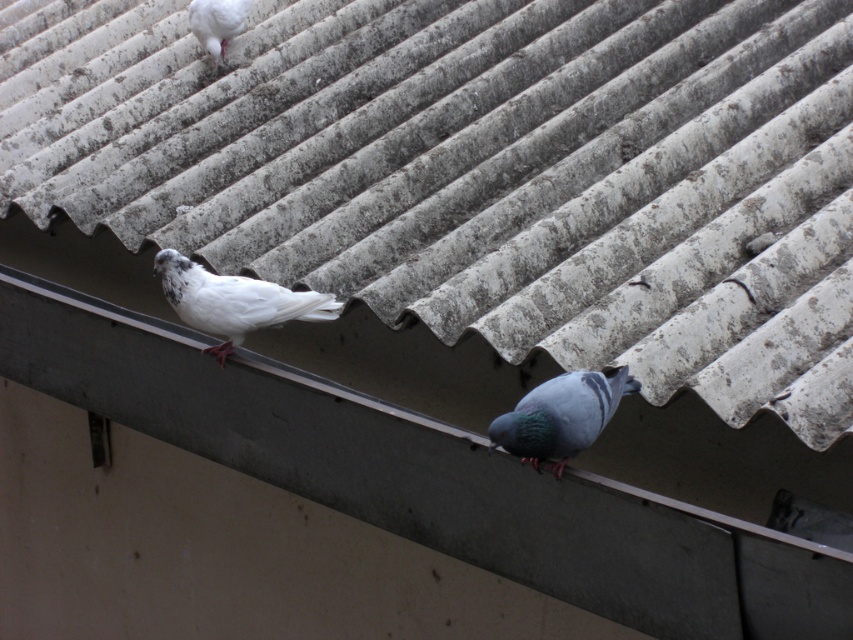
You are a birdwatcher observing the roof scene. You see the white matte bird at center and the shiny blue pigeon at center. Which one is closer to you?

The white matte bird at center is closer to you than the shiny blue pigeon at center.

You are a drone operator trying to capture a closeup of the pigeon on the roof. You have two points marked on your screen, point A at point (538,416) and point B at point (242,20). Which point should you target to get a closer shot of the pigeon?

Point A at point (538,416) is closer to the camera than point B at point (242,20), so targeting point A will provide a closer shot of the pigeon.

You are a bird watcher observing the roof scene. You notice the white corrugated metal at upper center and the shiny blue pigeon at center. Which object is closer to you?

The white corrugated metal at upper center is closer to you because it is in front of the shiny blue pigeon at center.